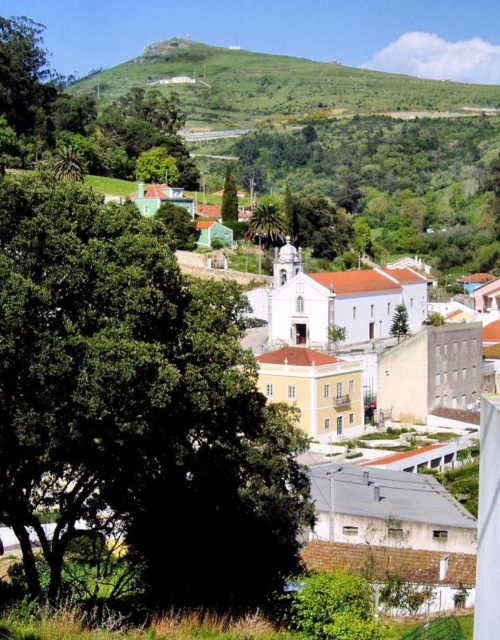
Does green leafy tree at center have a lesser height compared to green grassy hillside at upper center?

Yes.

Who is more distant from viewer, (25, 500) or (384, 83)?

The point (384, 83) is behind.

Describe the element at coordinates (137, 403) in the screenshot. I see `green leafy tree at center` at that location.

The image size is (500, 640). Find the location of `green leafy tree at center`. green leafy tree at center is located at coordinates (137, 403).

Is point (207, 436) in front of point (235, 216)?

Yes, point (207, 436) is in front of point (235, 216).

Between green leafy tree at center and green matte tree at center, which one is positioned higher?

green matte tree at center is above.

This screenshot has height=640, width=500. What do you see at coordinates (137, 403) in the screenshot?
I see `green leafy tree at center` at bounding box center [137, 403].

Image resolution: width=500 pixels, height=640 pixels. In order to click on green leafy tree at center in this screenshot , I will do `click(137, 403)`.

Is green grassy hillside at upper center taller than green matte tree at center?

Yes, green grassy hillside at upper center is taller than green matte tree at center.

Is point (389, 92) more distant than point (229, 173)?

Yes, point (389, 92) is farther from viewer.

What are the coordinates of `green grassy hillside at upper center` in the screenshot? It's located at (273, 84).